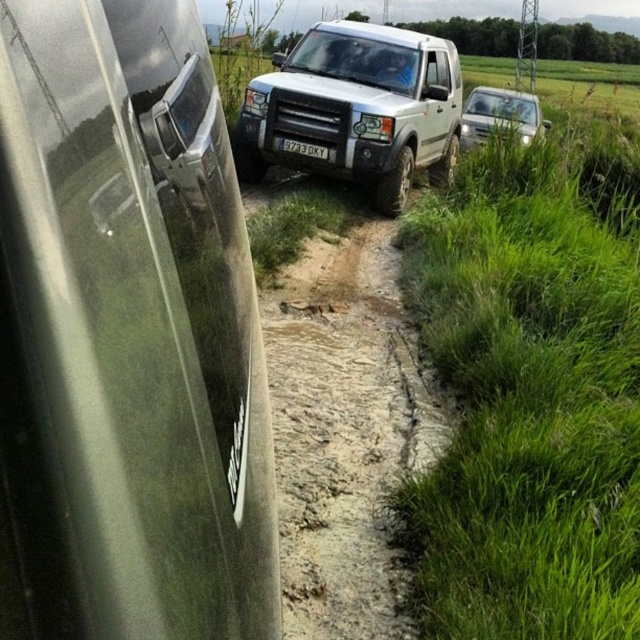
Identify the location of green grass at center. This screenshot has width=640, height=640. (531, 388).

Between point (509, 525) and point (397, 618), which one is positioned behind?

The point (397, 618) is behind.

Who is more distant from viewer, [627,163] or [305,509]?

Positioned behind is point [627,163].

Find the location of a particular element. green grass at center is located at coordinates (531, 388).

Is the position of white matte jeep at center more distant than that of white plastic license plate at center?

No, it is not.

The height and width of the screenshot is (640, 640). What do you see at coordinates (356, 108) in the screenshot? I see `white matte jeep at center` at bounding box center [356, 108].

The width and height of the screenshot is (640, 640). In order to click on white matte jeep at center in this screenshot , I will do `click(356, 108)`.

Who is shorter, white matte jeep at center or white matte car at upper right?

Standing shorter between the two is white matte car at upper right.

Does white matte jeep at center lie behind white matte car at upper right?

No, white matte jeep at center is in front of white matte car at upper right.

Between point (348, 168) and point (515, 116), which one is positioned behind?

The point (515, 116) is behind.

I want to click on white matte jeep at center, so click(x=356, y=108).